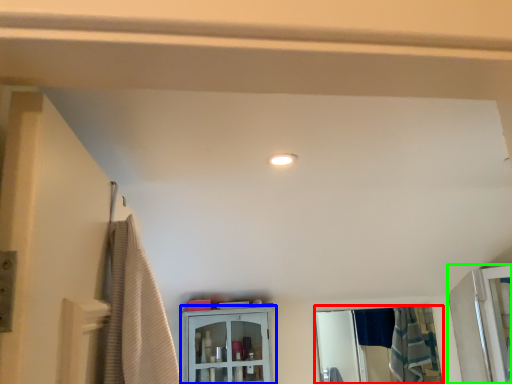
Question: Which object is positioned farthest from mirror (highlighted by a red box)? Select from cabinetry (highlighted by a blue box) and screen door (highlighted by a green box).

Choices:
 (A) cabinetry
 (B) screen door

Answer: (A)